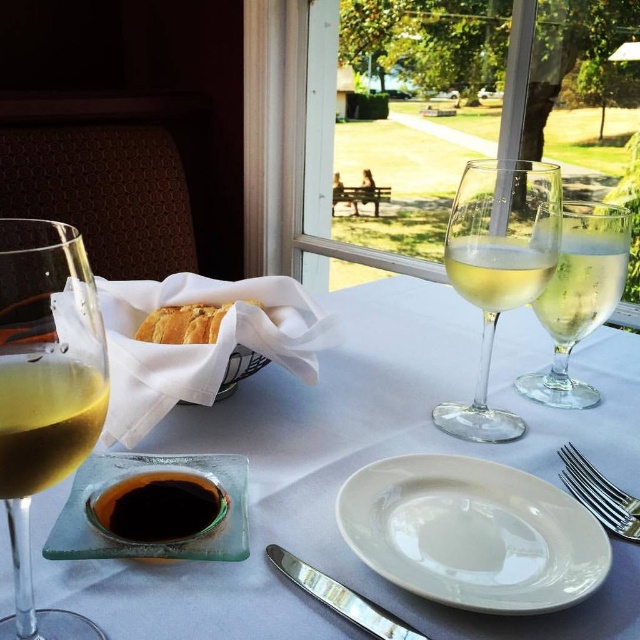
Question: Which object is positioned closest to the green grass at upper center?

Choices:
 (A) transparent glass ashtray at center
 (B) clear glass wine glass at upper right

Answer: (B)

Question: Is translucent glass wine glass at left further to camera compared to silver metallic fork at lower right?

Choices:
 (A) yes
 (B) no

Answer: (B)

Question: Does white glossy plate at center appear on the left side of silver metallic fork at lower right?

Choices:
 (A) yes
 (B) no

Answer: (A)

Question: Which of these objects is positioned closest to the green grass at upper center?

Choices:
 (A) clear glass wine glass at center
 (B) polished metal knife at center
 (C) white glossy plate at center
 (D) clear glass wine at upper right

Answer: (D)

Question: Based on their relative distances, which object is nearer to the silver metallic fork at lower right?

Choices:
 (A) clear glass wine at upper right
 (B) white glossy plate at center

Answer: (B)

Question: Is transparent glass ashtray at center wider than clear glass wine at center right?

Choices:
 (A) yes
 (B) no

Answer: (A)